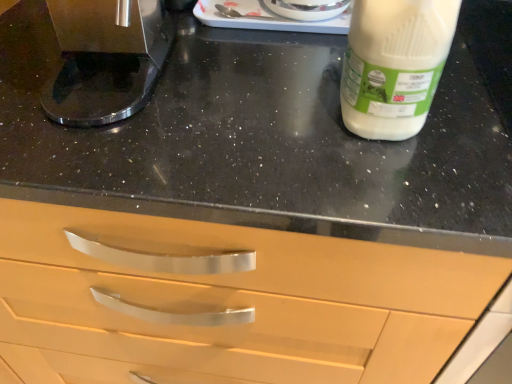
At what (x,y) coordinates should I click in order to perform the action: click on vacant space behind white plastic bottle at upper right. Please return your answer as a coordinate pair (x, y). This screenshot has width=512, height=384. Looking at the image, I should click on (316, 52).